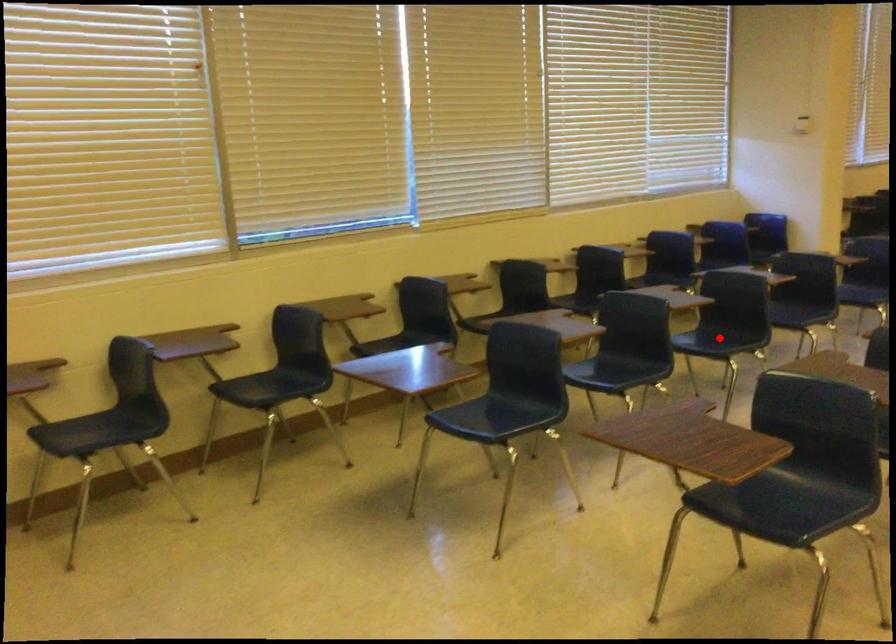
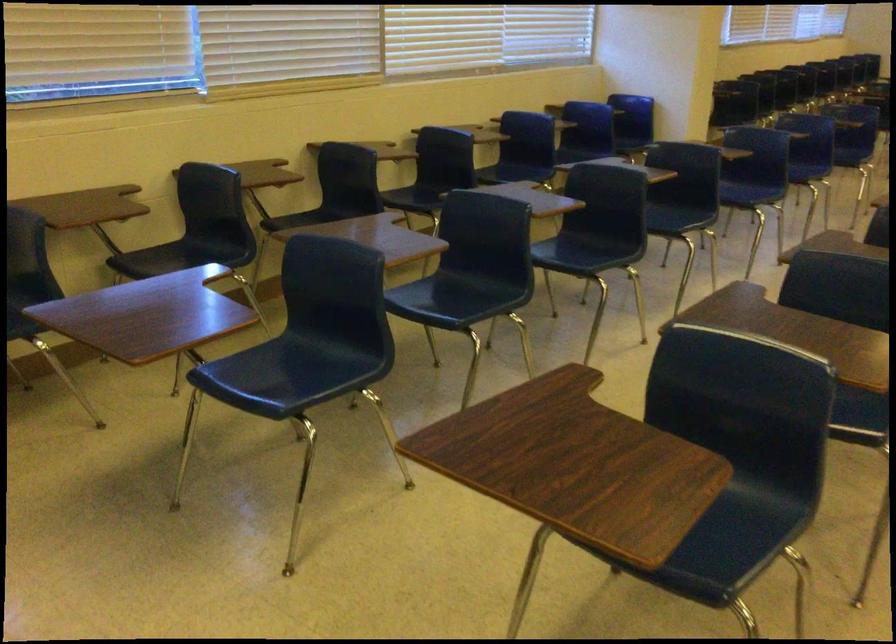
Question: I am providing you with two images of the same scene from different viewpoints. A red point is marked on the first image. Is the red point's position out of view in image 2?

Choices:
 (A) Yes
 (B) No

Answer: (B)